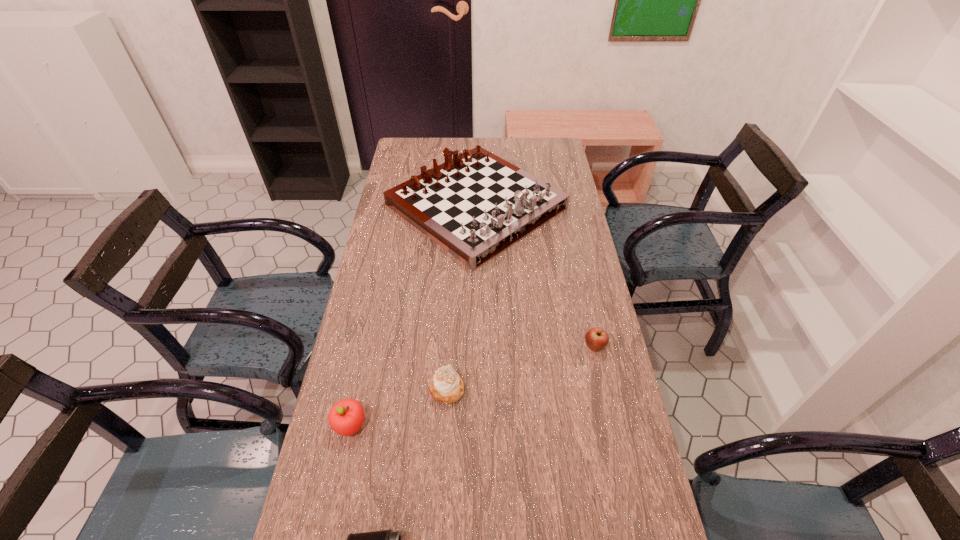
The width and height of the screenshot is (960, 540). Find the location of `vacant space located 0.310m on the back of the farther apple`. vacant space located 0.310m on the back of the farther apple is located at coordinates (577, 266).

The height and width of the screenshot is (540, 960). Identify the location of object present at the far edge. (476, 205).

I want to click on gameboard located in the left edge section of the desktop, so click(476, 205).

The width and height of the screenshot is (960, 540). Find the location of `apple that is positioned at the left edge`. apple that is positioned at the left edge is located at coordinates (346, 417).

The image size is (960, 540). Identify the location of gameboard present at the right edge. (476, 205).

Locate an element on the screen. This screenshot has height=540, width=960. apple that is positioned at the right edge is located at coordinates (596, 338).

At what (x,y) coordinates should I click in order to perform the action: click on object at the far left corner. Please return your answer as a coordinate pair (x, y). Looking at the image, I should click on (476, 205).

This screenshot has width=960, height=540. Find the location of `object located at the far right corner`. object located at the far right corner is located at coordinates (476, 205).

This screenshot has height=540, width=960. In the image, there is a desktop. Find the location of `free space at the far edge`. free space at the far edge is located at coordinates (499, 154).

The width and height of the screenshot is (960, 540). In order to click on blank area at the left edge in this screenshot , I will do `click(390, 246)`.